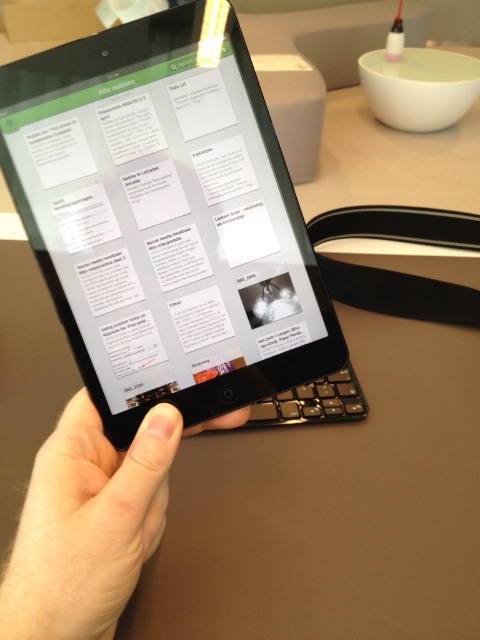
Who is more distant from viewer, (x=48, y=284) or (x=163, y=435)?

The point (x=48, y=284) is more distant.

Is black matte tablet at center above skinny white finger at center?

Yes.

Is point (129, 424) positioned after point (151, 428)?

Yes, it is.

Where is `black matte tablet at center`? This screenshot has width=480, height=640. black matte tablet at center is located at coordinates (165, 221).